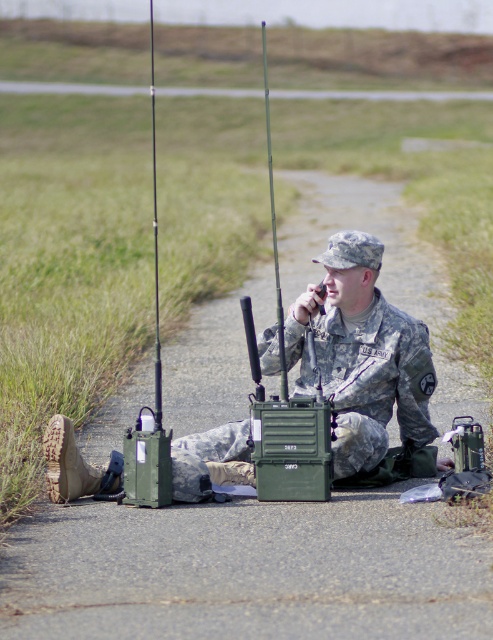
What are the coordinates of the camouflage fabric uniform at center?

The camouflage fabric uniform at center is located at coordinates point (361, 355).

You are a soldier who needs to retrieve your communication device. Which object is closer to you, the metallic silver pole at center or the green plastic fishing pole at center?

The metallic silver pole at center is closer to you because it is further to the viewer than the green plastic fishing pole at center, meaning it appears nearer in the image.

You are a photographer standing at the edge of the scene. You want to take a photo that includes both the camouflage fabric uniform at center and the metallic silver pole at center. Which object should you focus on first to ensure both are in sharp focus?

Since the camouflage fabric uniform at center is closer to the viewer than the metallic silver pole at center, you should focus on the camouflage fabric uniform at center first. This will ensure the metallic silver pole at center is within the depth of field and also in focus.